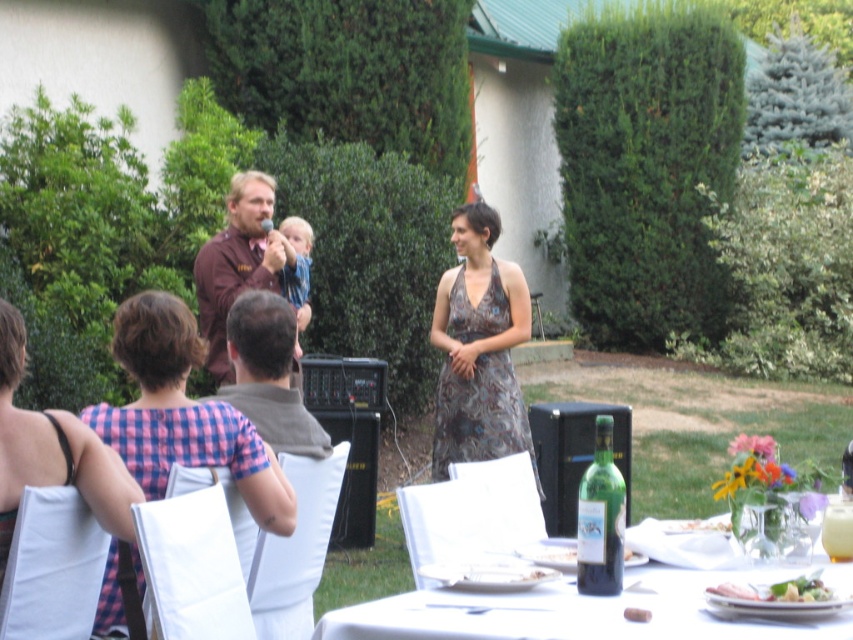
Question: Among these objects, which one is nearest to the camera?

Choices:
 (A) gray fabric vest at center
 (B) white porcelain plate at lower center
 (C) pink checkered dress at left

Answer: (B)

Question: Is the position of gray fabric vest at center more distant than that of white porcelain plate at lower center?

Choices:
 (A) no
 (B) yes

Answer: (B)

Question: Estimate the real-world distances between objects in this image. Which object is farther from the gray fabric vest at center?

Choices:
 (A) green glass bottle at lower center
 (B) brown fabric shirt at upper center
 (C) brown textured dress at center

Answer: (C)

Question: Considering the relative positions of gray fabric vest at center and white paper plate at lower center in the image provided, where is gray fabric vest at center located with respect to white paper plate at lower center?

Choices:
 (A) above
 (B) below

Answer: (A)

Question: Which point is farther to the camera?

Choices:
 (A) brown textured dress at center
 (B) pink checkered dress at left

Answer: (A)

Question: Does green glass bottle at lower center have a smaller size compared to brown textured dress at center?

Choices:
 (A) no
 (B) yes

Answer: (B)